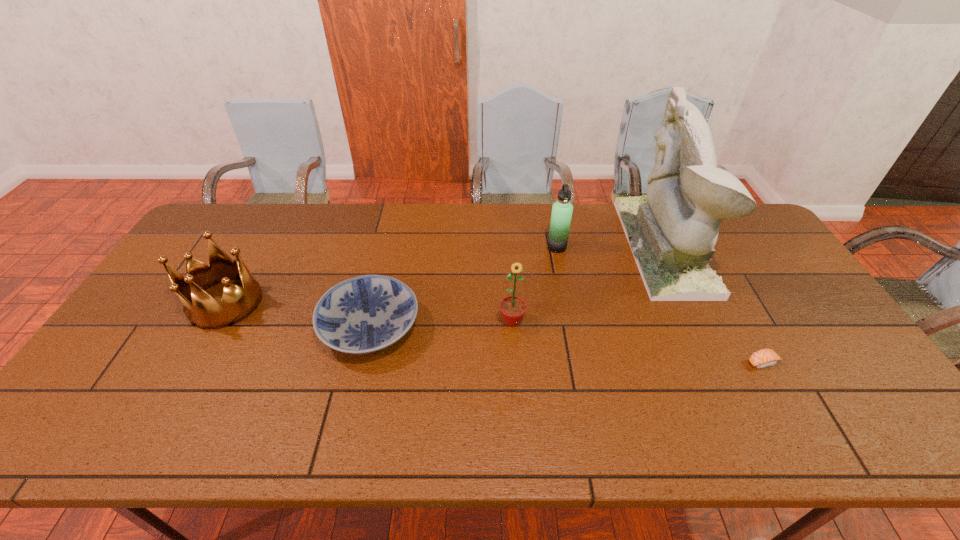
At what (x,y) coordinates should I click in order to perform the action: click on vacant region located 0.300m on the base of the sculpture. Please return your answer as a coordinate pair (x, y). This screenshot has height=540, width=960. Looking at the image, I should click on (539, 247).

What are the coordinates of `vacant point located 0.380m on the left of the third object from right to left` in the screenshot? It's located at (431, 247).

The height and width of the screenshot is (540, 960). Find the location of `free region located on the face of the sunflower`. free region located on the face of the sunflower is located at coordinates (520, 437).

At what (x,y) coordinates should I click in order to perform the action: click on free space located on the back of the leftmost object. Please return your answer as a coordinate pair (x, y). Looking at the image, I should click on (255, 249).

Locate an element on the screen. vacant space located on the left of the fifth tallest object is located at coordinates (273, 327).

This screenshot has width=960, height=540. Find the location of `vacant space located on the back of the shortest object`. vacant space located on the back of the shortest object is located at coordinates click(703, 254).

Find the location of a particular element. This screenshot has width=960, height=540. sculpture positioned at the far edge is located at coordinates (672, 231).

This screenshot has width=960, height=540. What are the coordinates of `thermos bottle that is at the far edge` in the screenshot? It's located at (562, 210).

This screenshot has width=960, height=540. What are the coordinates of `object that is at the left edge` in the screenshot? It's located at (202, 310).

Find the location of a particular element. This screenshot has width=960, height=540. free spot at the far edge of the desktop is located at coordinates (532, 212).